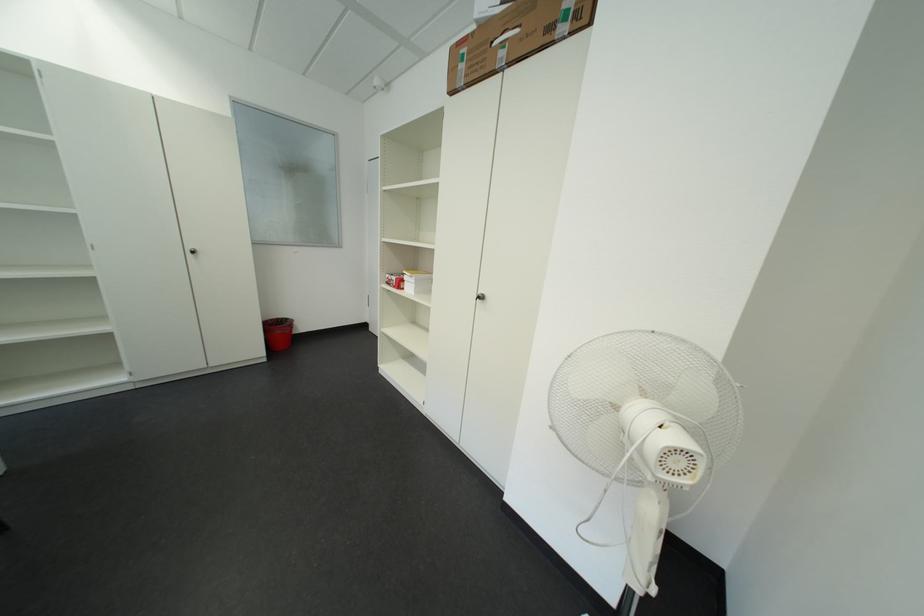
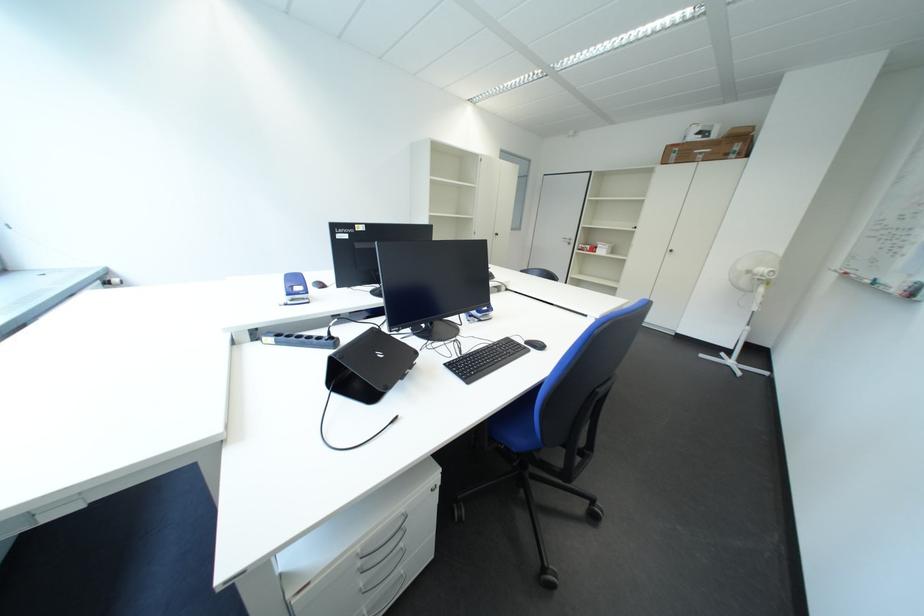
Question: I am providing you with two images of the same scene from different viewpoints. Please identify which objects are invisible in image2.

Choices:
 (A) white detergent bottle
 (B) cardboard box
 (C) red trash can
 (D) cabinet door handle

Answer: (C)